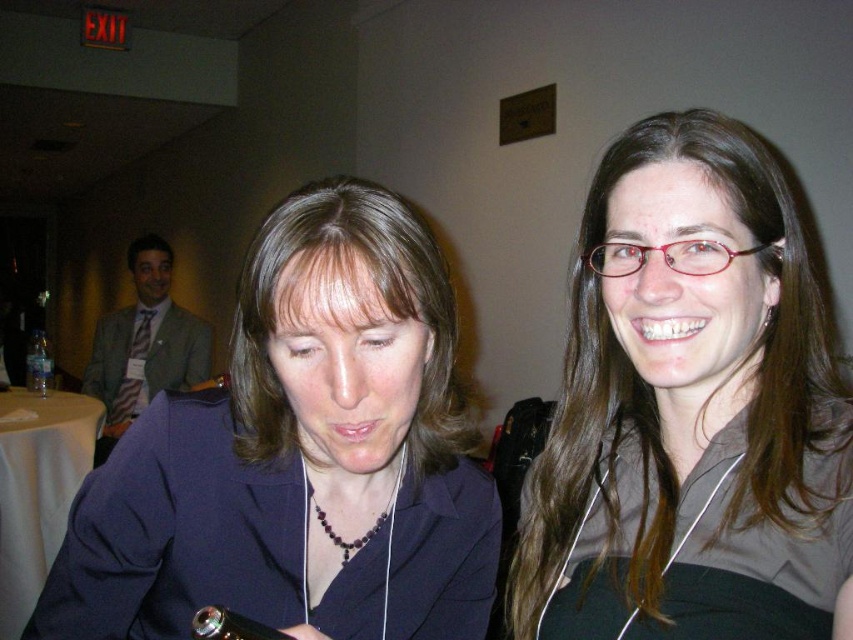
Question: Which object is positioned farthest from the clear plastic bottle at left?

Choices:
 (A) matte blue blazer at center
 (B) matte gray shirt at upper right
 (C) dark purple beaded necklace at center

Answer: (B)

Question: Which point is closer to the camera?

Choices:
 (A) click(x=399, y=323)
 (B) click(x=527, y=486)
 (C) click(x=341, y=556)
 (D) click(x=28, y=337)

Answer: (A)

Question: Can you confirm if matte gray shirt at upper right is positioned to the right of dark purple beaded necklace at center?

Choices:
 (A) yes
 (B) no

Answer: (A)

Question: Can you confirm if matte blue blazer at center is positioned above dark purple beaded necklace at center?

Choices:
 (A) yes
 (B) no

Answer: (B)

Question: Which of these objects is positioned farthest from the matte blue blazer at center?

Choices:
 (A) matte gray shirt at upper right
 (B) clear plastic bottle at left
 (C) dark purple beaded necklace at center

Answer: (B)

Question: Is dark purple beaded necklace at center further to camera compared to clear plastic bottle at left?

Choices:
 (A) yes
 (B) no

Answer: (B)